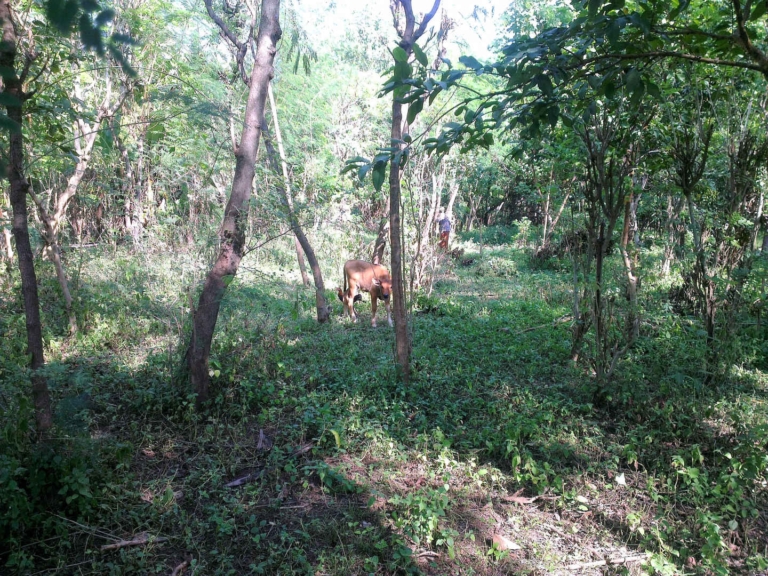
The height and width of the screenshot is (576, 768). In order to click on light glare in this screenshot , I will do `click(329, 269)`, `click(170, 272)`.